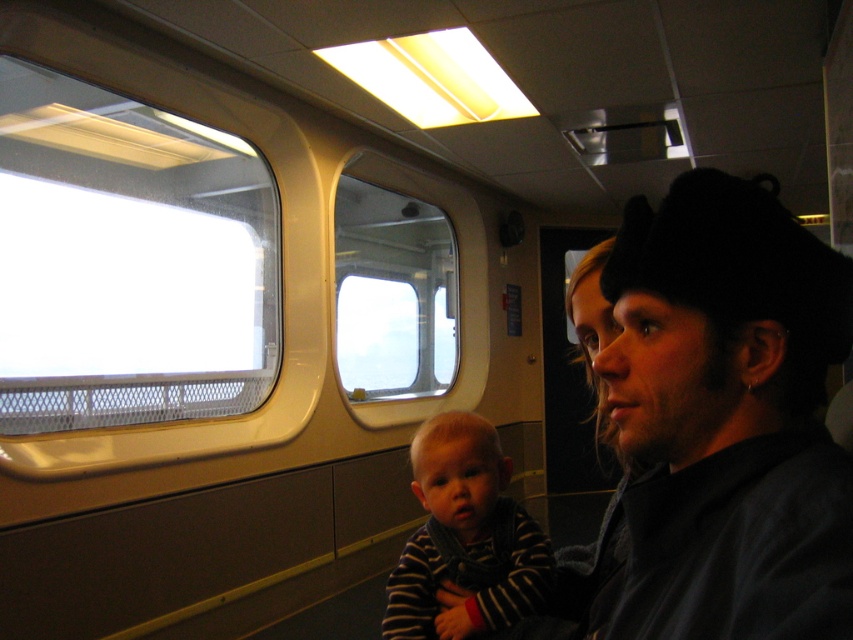
You are an interior designer assessing the placement of objects in the train compartment. The black knit cap at upper right has coordinates at point 0.655, 0.852. Is this cap positioned closer to the window or the wall?

The black knit cap at upper right is positioned closer to the window since its coordinates at [726,419] place it near the upper right corner where the window is located.

You are a parent traveling with your child in a moving train. You want to let your child look outside through the window. Which window between the transparent glass window at upper left and the clear glass window at center would allow the child to see further outside? Explain your reasoning.

Both the transparent glass window at upper left and the clear glass window at center are made of glass, so they both provide clear visibility. However, the clear glass window at center might offer a better view because it is positioned lower and closer to the child, allowing them to see further outside without obstruction. The distance between the two windows is 1.75 meters, but this doesn t affect the viewing distance. The clarity of the glass and the child s height relative to the window positions would d

You are sitting in the train and want to look outside. You notice the transparent glass window at upper left and the clear glass window at center. Which window is closer to you?

The transparent glass window at upper left is closer to you because it is in front of the clear glass window at center.